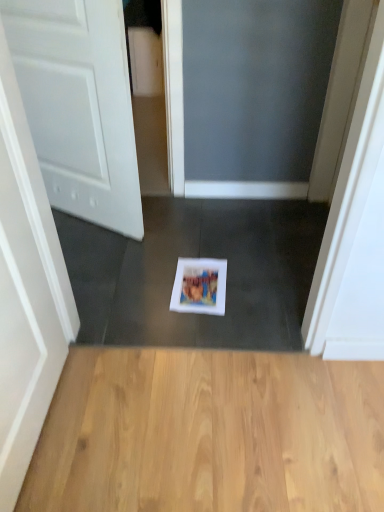
Find the location of a particular element. free point above white paper at center (from a real-world perspective) is located at coordinates (201, 285).